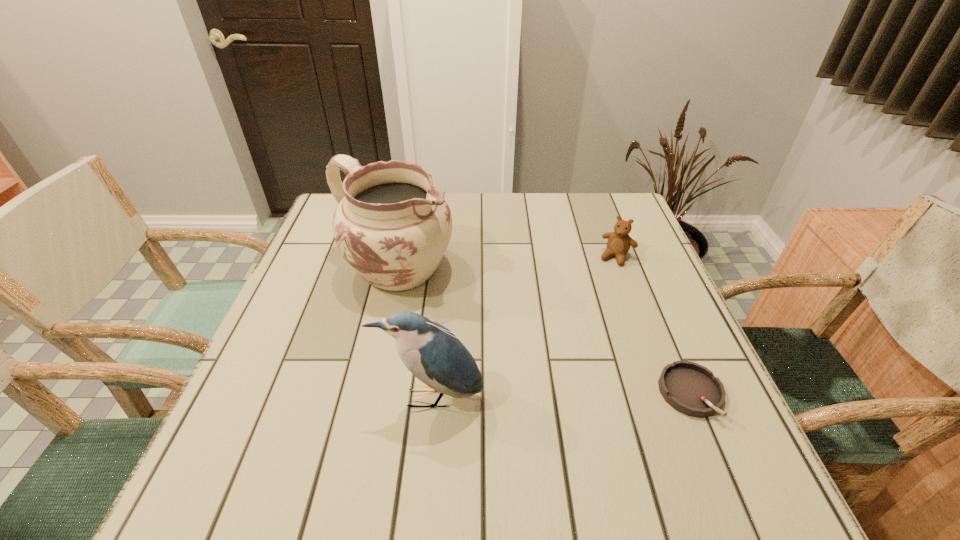
At what (x,y) coordinates should I click in order to perform the action: click on vacant space at the far edge of the desktop. Please return your answer as a coordinate pair (x, y). This screenshot has width=960, height=540. Looking at the image, I should click on (520, 202).

Image resolution: width=960 pixels, height=540 pixels. In order to click on vacant space at the near edge of the desktop in this screenshot , I will do `click(605, 428)`.

The height and width of the screenshot is (540, 960). I want to click on vacant area at the left edge of the desktop, so click(284, 322).

This screenshot has width=960, height=540. I want to click on vacant space at the right edge, so click(645, 341).

Identify the location of free region at the far left corner of the desktop. (327, 235).

This screenshot has height=540, width=960. Find the location of `free space at the near right corner`. free space at the near right corner is located at coordinates (648, 421).

This screenshot has width=960, height=540. I want to click on blank region between the tallest object and the third tallest object, so click(x=506, y=263).

Identify the location of unoccupied position between the third tallest object and the shortest object. This screenshot has width=960, height=540. (654, 326).

Identify the location of empty space that is in between the third shortest object and the teddy bear. Image resolution: width=960 pixels, height=540 pixels. (524, 327).

In order to click on empty location between the pitcher and the teddy bear in this screenshot , I will do `click(506, 263)`.